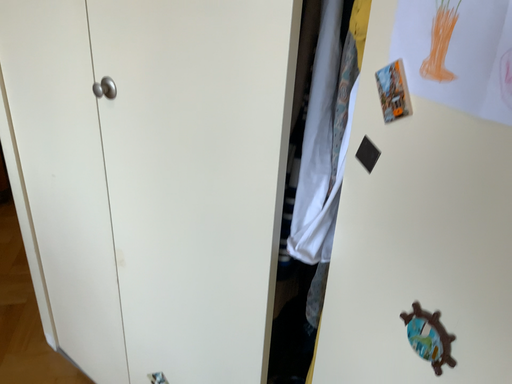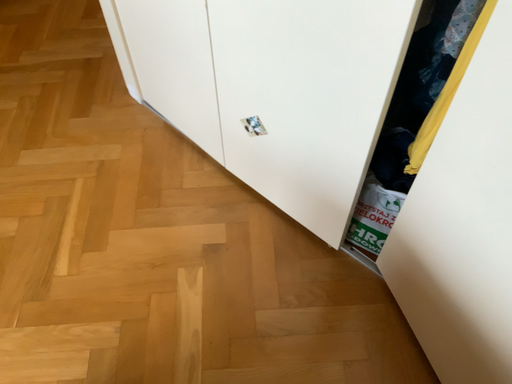
Question: Which way did the camera rotate in the video?

Choices:
 (A) rotated left
 (B) rotated right

Answer: (A)